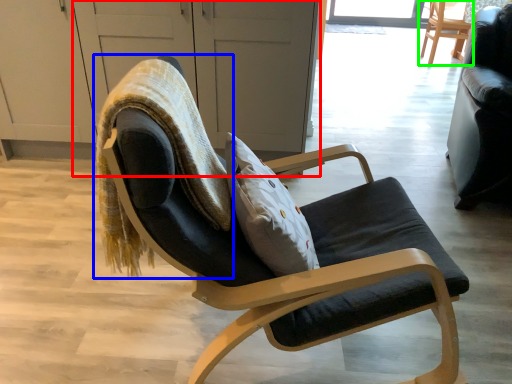
Question: Based on their relative distances, which object is nearer to screen door (highlighted by a red box)? Choose from bean bag chair (highlighted by a blue box) and chair (highlighted by a green box).

Choices:
 (A) bean bag chair
 (B) chair

Answer: (A)